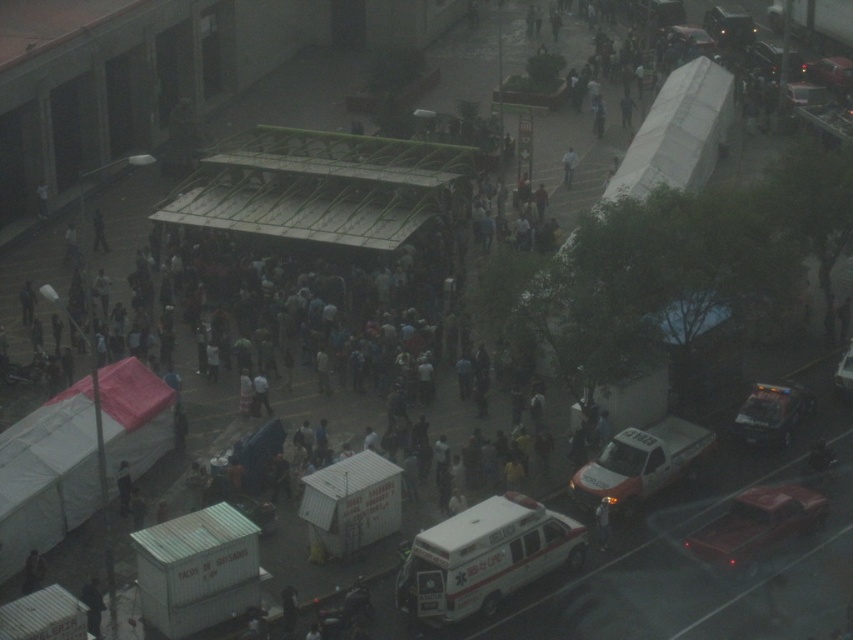
You are a pedestrian standing at the edge of the crowd near the white fabric canopy at lower left. You need to cross the street to reach the police vehicle marked. Can you see the white glossy ambulance at center from your current position?

The white glossy ambulance at center is behind the white fabric canopy at lower left, so you cannot see it from your current position near the white fabric canopy at lower left.